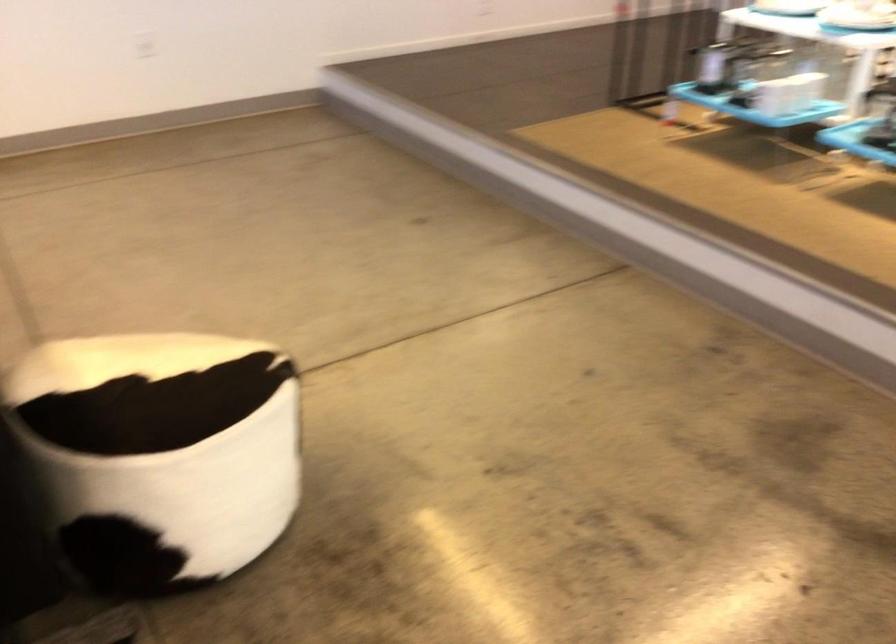
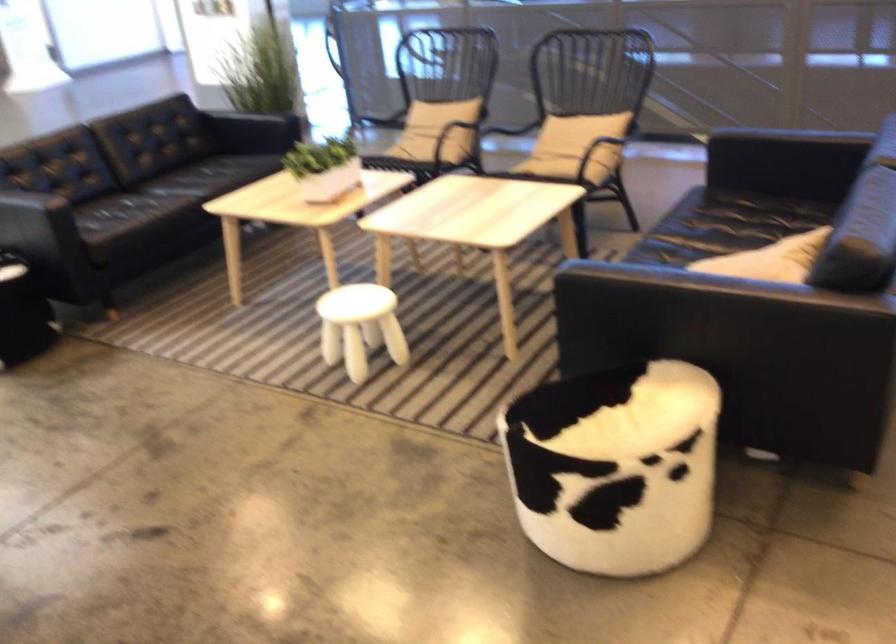
The point at (x=261, y=355) is marked in the first image. Where is the corresponding point in the second image?

(615, 466)